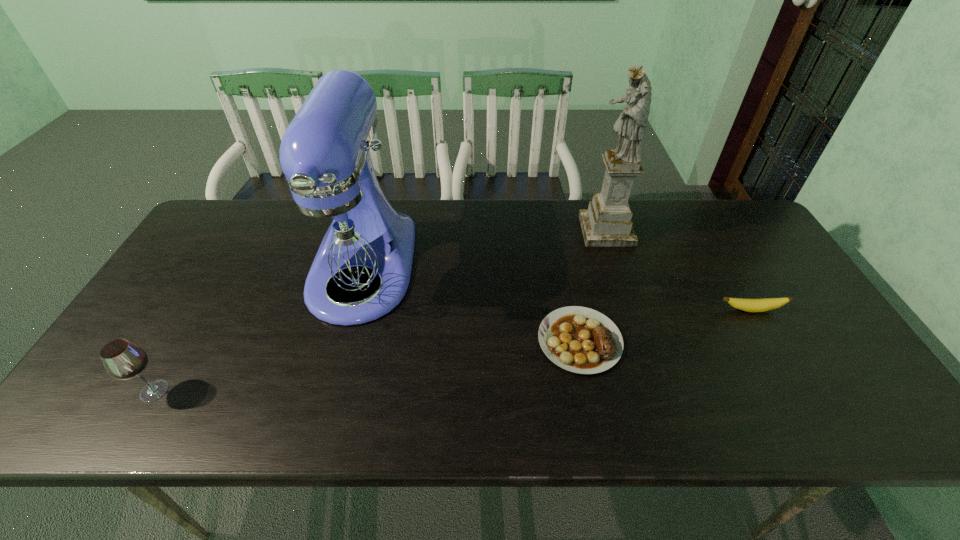
The image size is (960, 540). I want to click on vacant space that is in between the sculpture and the mixer, so click(484, 249).

In order to click on free space between the shortest object and the mixer in this screenshot , I will do `click(471, 305)`.

Locate an element on the screen. The image size is (960, 540). free space between the steak and the sculpture is located at coordinates (593, 286).

Where is `object that is the second closest to the fourth object from right to left`? object that is the second closest to the fourth object from right to left is located at coordinates (578, 339).

Select which object is the second closest to the mixer. Please provide its 2D coordinates. Your answer should be formatted as a tuple, i.e. [(x, y)], where the tuple contains the x and y coordinates of a point satisfying the conditions above.

[(578, 339)]

Image resolution: width=960 pixels, height=540 pixels. In order to click on vacant space that satisfies the following two spatial constraints: 1. on the front-facing side of the sculpture; 2. on the right side of the rightmost object in this screenshot , I will do `click(632, 310)`.

At what (x,y) coordinates should I click in order to perform the action: click on blank space that satisfies the following two spatial constraints: 1. at the mixing area of the steak; 2. on the right side of the second object from left to right. Please return your answer as a coordinate pair (x, y). This screenshot has width=960, height=540. Looking at the image, I should click on (343, 341).

Find the location of a particular element. Image resolution: width=960 pixels, height=540 pixels. free point that satisfies the following two spatial constraints: 1. on the back side of the steak; 2. on the right side of the wineglass is located at coordinates (184, 341).

In order to click on vacant area in the image that satisfies the following two spatial constraints: 1. on the front-facing side of the sculpture; 2. on the back side of the rightmost object in this screenshot , I will do `click(632, 310)`.

Where is `vacant space that satisfies the following two spatial constraints: 1. on the back side of the steak; 2. on the right side of the banana`? The height and width of the screenshot is (540, 960). vacant space that satisfies the following two spatial constraints: 1. on the back side of the steak; 2. on the right side of the banana is located at coordinates (574, 310).